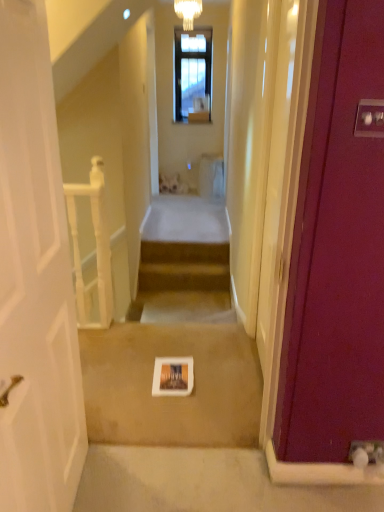
Question: Is white glass chandelier at upper center inside the boundaries of white wooden balustrade at left, or outside?

Choices:
 (A) outside
 (B) inside

Answer: (A)

Question: Does point (190, 25) appear closer or farther from the camera than point (99, 229)?

Choices:
 (A) farther
 (B) closer

Answer: (A)

Question: Which of these objects is positioned closest to the white glass chandelier at upper center?

Choices:
 (A) white wooden balustrade at left
 (B) white matte book at center

Answer: (A)

Question: Estimate the real-world distances between objects in this image. Which object is farther from the white glass chandelier at upper center?

Choices:
 (A) white wooden balustrade at left
 (B) white matte book at center

Answer: (B)